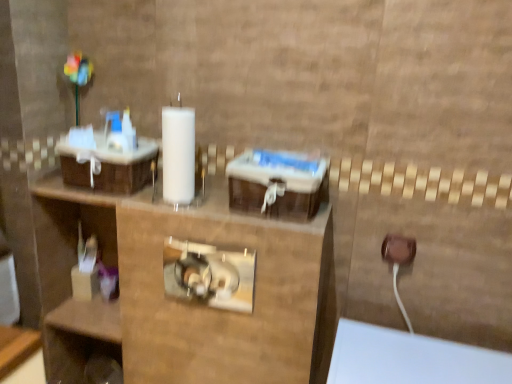
Question: From a real-world perspective, relative to brown woven basket at left, is brown plastic outlet at lower right vertically above or below?

Choices:
 (A) above
 (B) below

Answer: (B)

Question: Is brown plastic outlet at lower right in front of or behind brown woven basket at left in the image?

Choices:
 (A) behind
 (B) front

Answer: (A)

Question: Which is farther from the brown woven basket at left?

Choices:
 (A) translucent plastic container at lower left
 (B) brown plastic outlet at lower right

Answer: (B)

Question: Which object is the farthest from the brown plastic outlet at lower right?

Choices:
 (A) translucent plastic container at lower left
 (B) brown woven basket at left

Answer: (A)